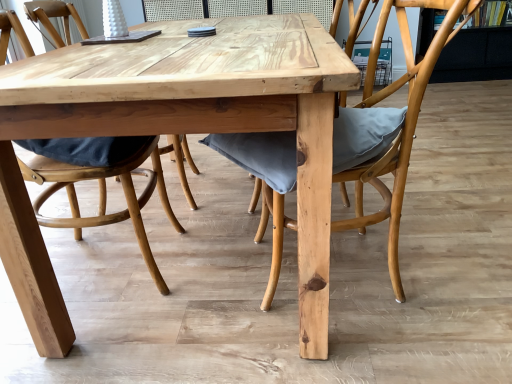
Where is `matte gray cushion at center, the second chair viewed from the left`? This screenshot has width=512, height=384. matte gray cushion at center, the second chair viewed from the left is located at coordinates (401, 127).

From the image's perspective, which is below, natural wood table at center or matte wood chair at center, which is counted as the first chair, starting from the left?

matte wood chair at center, which is counted as the first chair, starting from the left, from the image's perspective.

From a real-world perspective, which object stands above the other?

matte wood chair at center, acting as the second chair starting from the right.

In terms of size, does natural wood table at center appear bigger or smaller than matte wood chair at center, which is counted as the first chair, starting from the left?

Considering their sizes, natural wood table at center takes up more space than matte wood chair at center, which is counted as the first chair, starting from the left.

Which is behind, natural wood table at center or matte wood chair at center, which is counted as the first chair, starting from the left?

matte wood chair at center, which is counted as the first chair, starting from the left, is further away from the camera.

Is matte wood chair at center, acting as the second chair starting from the right, positioned far away from natural wood table at center?

They are positioned close to each other.

Considering the positions of point (88, 177) and point (95, 48), is point (88, 177) closer or farther from the camera than point (95, 48)?

Point (88, 177) appears to be farther away from the viewer than point (95, 48).

Does matte wood chair at center, which is counted as the first chair, starting from the left, come in front of natural wood table at center?

No, it is behind natural wood table at center.

I want to click on kitchen & dining room table that is in front of the matte wood chair at center, acting as the second chair starting from the right, so click(177, 133).

Considering the relative positions of natural wood table at center and matte gray cushion at center, the second chair viewed from the left, in the image provided, is natural wood table at center to the left of matte gray cushion at center, the second chair viewed from the left, from the viewer's perspective?

Correct, you'll find natural wood table at center to the left of matte gray cushion at center, the second chair viewed from the left.

From the image's perspective, which object appears higher, natural wood table at center or matte gray cushion at center, which is the first chair in right-to-left order?

natural wood table at center is shown above in the image.

Who is more distant, natural wood table at center or matte gray cushion at center, the second chair viewed from the left?

matte gray cushion at center, the second chair viewed from the left, is further from the camera.

Based on the photo, is natural wood table at center oriented towards matte gray cushion at center, the second chair viewed from the left?

Yes, natural wood table at center is facing matte gray cushion at center, the second chair viewed from the left.

You are a GUI agent. You are given a task and a screenshot of the screen. Output one action in this format:
    pyautogui.click(x=<x>, y=<y>)
    Task: Click on the chair lying on the right of natural wood table at center
    The image size is (512, 384).
    Given the screenshot: What is the action you would take?
    [401, 127]

Which is behind, point (448, 35) or point (328, 274)?

The point (328, 274) is more distant.

Which object is further away from the camera taking this photo, matte gray cushion at center, which is the first chair in right-to-left order, or natural wood table at center?

matte gray cushion at center, which is the first chair in right-to-left order, is behind.

Is matte gray cushion at center, the second chair viewed from the left, spatially inside natural wood table at center, or outside of it?

matte gray cushion at center, the second chair viewed from the left, lies within the bounds of natural wood table at center.

Is matte wood chair at center, acting as the second chair starting from the right, aimed at matte gray cushion at center, the second chair viewed from the left?

Yes, matte wood chair at center, acting as the second chair starting from the right, is aimed at matte gray cushion at center, the second chair viewed from the left.

Which point is more forward, (62, 175) or (389, 243)?

Positioned in front is point (62, 175).

At what (x,y) coordinates should I click in order to perform the action: click on chair on the right of matte wood chair at center, which is counted as the first chair, starting from the left. Please return your answer as a coordinate pair (x, y). Looking at the image, I should click on (401, 127).

Consider the image. Which object is closer to the camera taking this photo, matte wood chair at center, which is counted as the first chair, starting from the left, or matte gray cushion at center, which is the first chair in right-to-left order?

matte gray cushion at center, which is the first chair in right-to-left order, is closer to the camera.

Consider the image. Considering the sizes of objects matte gray cushion at center, which is the first chair in right-to-left order, and matte wood chair at center, which is counted as the first chair, starting from the left, in the image provided, who is bigger, matte gray cushion at center, which is the first chair in right-to-left order, or matte wood chair at center, which is counted as the first chair, starting from the left,?

Bigger between the two is matte gray cushion at center, which is the first chair in right-to-left order.

Between matte gray cushion at center, the second chair viewed from the left, and matte wood chair at center, acting as the second chair starting from the right, which one appears on the right side from the viewer's perspective?

matte gray cushion at center, the second chair viewed from the left.

What's the angular difference between matte gray cushion at center, the second chair viewed from the left, and matte wood chair at center, acting as the second chair starting from the right,'s facing directions?

The angle between the facing direction of matte gray cushion at center, the second chair viewed from the left, and the facing direction of matte wood chair at center, acting as the second chair starting from the right, is 180 degrees.

Which of these two, matte gray cushion at center, which is the first chair in right-to-left order, or matte wood chair at center, acting as the second chair starting from the right, stands taller?

matte wood chair at center, acting as the second chair starting from the right.

Locate an element on the screen. This screenshot has width=512, height=384. chair on the left of natural wood table at center is located at coordinates [x=105, y=196].

At what (x,y) coordinates should I click in order to perform the action: click on chair that is the 2nd one when counting downward from the natural wood table at center (from the image's perspective). Please return your answer as a coordinate pair (x, y). This screenshot has height=384, width=512. Looking at the image, I should click on (105, 196).

Based on their spatial positions, is matte wood chair at center, acting as the second chair starting from the right, or matte gray cushion at center, the second chair viewed from the left, closer to natural wood table at center?

Based on the image, matte gray cushion at center, the second chair viewed from the left, appears to be nearer to natural wood table at center.

Which object lies further to the anchor point matte gray cushion at center, the second chair viewed from the left, matte wood chair at center, which is counted as the first chair, starting from the left, or natural wood table at center?

matte wood chair at center, which is counted as the first chair, starting from the left, is positioned further to the anchor matte gray cushion at center, the second chair viewed from the left.

Estimate the real-world distances between objects in this image. Which object is further from matte wood chair at center, which is counted as the first chair, starting from the left, matte gray cushion at center, which is the first chair in right-to-left order, or natural wood table at center?

matte gray cushion at center, which is the first chair in right-to-left order, lies further to matte wood chair at center, which is counted as the first chair, starting from the left, than the other object.

Considering their positions, is natural wood table at center positioned closer to matte wood chair at center, acting as the second chair starting from the right, than matte gray cushion at center, which is the first chair in right-to-left order?

natural wood table at center is closer to matte wood chair at center, acting as the second chair starting from the right.

From the image, which object appears to be nearer to natural wood table at center, matte gray cushion at center, the second chair viewed from the left, or matte wood chair at center, acting as the second chair starting from the right?

matte gray cushion at center, the second chair viewed from the left, is closer to natural wood table at center.

Based on their spatial positions, is natural wood table at center or matte wood chair at center, acting as the second chair starting from the right, closer to matte gray cushion at center, the second chair viewed from the left?

The object closer to matte gray cushion at center, the second chair viewed from the left, is natural wood table at center.

Image resolution: width=512 pixels, height=384 pixels. Find the location of `kitchen & dining room table between matte wood chair at center, acting as the second chair starting from the right, and matte gray cushion at center, which is the first chair in right-to-left order`. kitchen & dining room table between matte wood chair at center, acting as the second chair starting from the right, and matte gray cushion at center, which is the first chair in right-to-left order is located at coordinates (177, 133).